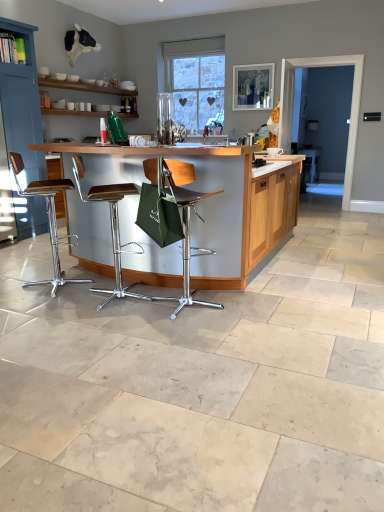
Question: Is blue painted wood cabinet at left surrounded by metallic brown stool at left, the 1th chair from the left?

Choices:
 (A) no
 (B) yes

Answer: (A)

Question: Is metallic brown stool at left, the 1th chair from the left, smaller than blue painted wood cabinet at left?

Choices:
 (A) yes
 (B) no

Answer: (A)

Question: Is metallic brown stool at left, the 1th chair from the left, taller than blue painted wood cabinet at left?

Choices:
 (A) yes
 (B) no

Answer: (B)

Question: Is metallic brown stool at left, marked as the third chair in a right-to-left arrangement, positioned before blue painted wood cabinet at left?

Choices:
 (A) yes
 (B) no

Answer: (A)

Question: From a real-world perspective, is metallic brown stool at left, the 1th chair from the left, on blue painted wood cabinet at left?

Choices:
 (A) no
 (B) yes

Answer: (A)

Question: Considering the positions of point (233, 252) and point (182, 248), is point (233, 252) closer or farther from the camera than point (182, 248)?

Choices:
 (A) farther
 (B) closer

Answer: (A)

Question: In terms of width, does wooden table at center look wider or thinner when compared to green fabric chair at center, the first chair positioned from the right?

Choices:
 (A) wide
 (B) thin

Answer: (A)

Question: Considering the positions of wooden table at center and green fabric chair at center, the 3th chair in the left-to-right sequence, in the image, is wooden table at center bigger or smaller than green fabric chair at center, the 3th chair in the left-to-right sequence,?

Choices:
 (A) big
 (B) small

Answer: (A)

Question: From a real-world perspective, relative to green fabric chair at center, the first chair positioned from the right, is wooden table at center vertically above or below?

Choices:
 (A) above
 (B) below

Answer: (A)

Question: Considering the positions of metallic brown stool at center, placed as the second chair when sorted from right to left, and wooden table at center in the image, is metallic brown stool at center, placed as the second chair when sorted from right to left, taller or shorter than wooden table at center?

Choices:
 (A) tall
 (B) short

Answer: (B)

Question: Based on their sizes in the image, would you say metallic brown stool at center, placed as the second chair when sorted from right to left, is bigger or smaller than wooden table at center?

Choices:
 (A) big
 (B) small

Answer: (B)

Question: From a real-world perspective, relative to wooden table at center, is metallic brown stool at center, acting as the 2th chair starting from the left, vertically above or below?

Choices:
 (A) above
 (B) below

Answer: (B)

Question: Is point (119, 273) closer or farther from the camera than point (206, 274)?

Choices:
 (A) farther
 (B) closer

Answer: (A)

Question: Do you think wooden table at center is within transparent glass door at right, or outside of it?

Choices:
 (A) inside
 (B) outside

Answer: (B)

Question: From the image's perspective, is wooden table at center above or below transparent glass door at right?

Choices:
 (A) above
 (B) below

Answer: (B)